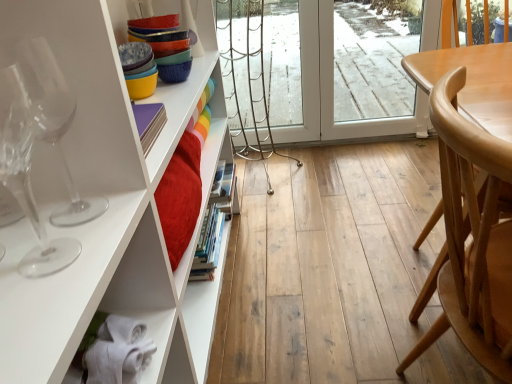
Question: Is light brown wood chair at right at the back of transparent glass wine glass at left, the second wine glass in the front-to-back sequence?

Choices:
 (A) no
 (B) yes

Answer: (A)

Question: Are transparent glass wine glass at left, the second wine glass in the front-to-back sequence, and light brown wood chair at right far apart?

Choices:
 (A) no
 (B) yes

Answer: (A)

Question: Does transparent glass wine glass at left, the second wine glass in the front-to-back sequence, lie in front of light brown wood chair at right?

Choices:
 (A) yes
 (B) no

Answer: (B)

Question: Is transparent glass wine glass at left, the 1th wine glass when ordered from back to front, taller than light brown wood chair at right?

Choices:
 (A) yes
 (B) no

Answer: (B)

Question: From the image's perspective, does transparent glass wine glass at left, the 1th wine glass when ordered from back to front, appear higher than light brown wood chair at right?

Choices:
 (A) yes
 (B) no

Answer: (A)

Question: From a real-world perspective, is light brown wood chair at right positioned above or below transparent glass wine glass at left, arranged as the second wine glass when viewed from the back?

Choices:
 (A) below
 (B) above

Answer: (A)

Question: Is light brown wood chair at right in front of or behind transparent glass wine glass at left, the first wine glass viewed from the front, in the image?

Choices:
 (A) front
 (B) behind

Answer: (B)

Question: Would you say light brown wood chair at right is to the left or to the right of transparent glass wine glass at left, the first wine glass viewed from the front, in the picture?

Choices:
 (A) left
 (B) right

Answer: (B)

Question: In terms of size, does light brown wood chair at right appear bigger or smaller than transparent glass wine glass at left, the first wine glass viewed from the front?

Choices:
 (A) big
 (B) small

Answer: (A)

Question: Is transparent glass wine glass at left, the first wine glass viewed from the front, inside the boundaries of light brown wood chair at right, or outside?

Choices:
 (A) inside
 (B) outside

Answer: (B)

Question: From a real-world perspective, is transparent glass wine glass at left, arranged as the second wine glass when viewed from the back, above or below light brown wood chair at right?

Choices:
 (A) above
 (B) below

Answer: (A)

Question: From the image's perspective, is transparent glass wine glass at left, arranged as the second wine glass when viewed from the back, positioned above or below light brown wood chair at right?

Choices:
 (A) below
 (B) above

Answer: (B)

Question: In terms of size, does transparent glass wine glass at left, the first wine glass viewed from the front, appear bigger or smaller than light brown wood chair at right?

Choices:
 (A) big
 (B) small

Answer: (B)

Question: Is transparent glass wine glass at left, the first wine glass viewed from the front, inside or outside of transparent glass wine glass at left, the 1th wine glass when ordered from back to front?

Choices:
 (A) outside
 (B) inside

Answer: (A)

Question: Is point (14, 74) closer or farther from the camera than point (31, 72)?

Choices:
 (A) closer
 (B) farther

Answer: (A)